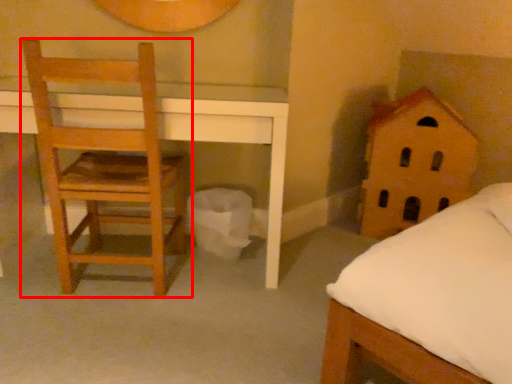
Question: From the image's perspective, considering the relative positions of chair (annotated by the red box) and toy in the image provided, where is chair (annotated by the red box) located with respect to the staircase?

Choices:
 (A) above
 (B) below

Answer: (B)